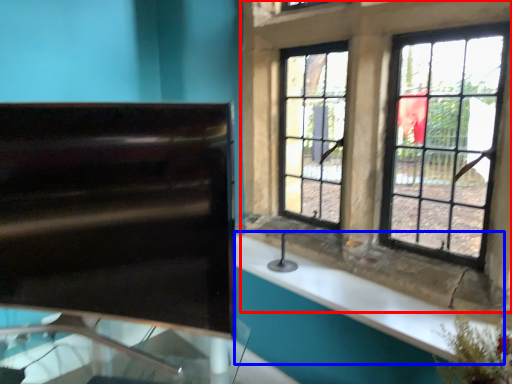
Question: Among these objects, which one is nearest to the camera, window (highlighted by a red box) or counter top (highlighted by a blue box)?

Choices:
 (A) window
 (B) counter top

Answer: (A)